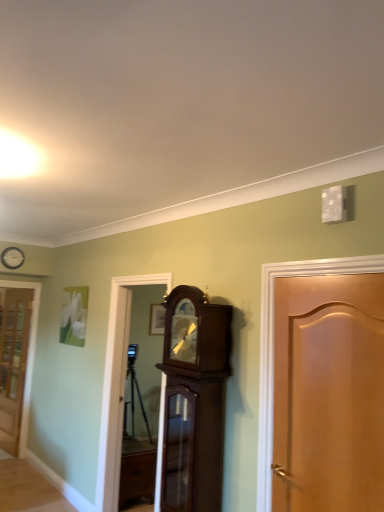
Question: Can you confirm if brown wooden cabinet at center, which ranks as the first cabinetry in back-to-front order, is taller than mahogany wood grandfather clock at center, the first cabinetry from the top?

Choices:
 (A) yes
 (B) no

Answer: (B)

Question: Is brown wooden cabinet at center, placed as the second cabinetry when sorted from front to back, closer to camera compared to mahogany wood grandfather clock at center, the 2th cabinetry in the back-to-front sequence?

Choices:
 (A) no
 (B) yes

Answer: (A)

Question: From the image's perspective, is brown wooden cabinet at center, which ranks as the first cabinetry in back-to-front order, located beneath mahogany wood grandfather clock at center, which ranks as the second cabinetry in bottom-to-top order?

Choices:
 (A) no
 (B) yes

Answer: (B)

Question: Is brown wooden cabinet at center, placed as the second cabinetry when sorted from front to back, bigger than mahogany wood grandfather clock at center, the 2th cabinetry viewed from the left?

Choices:
 (A) yes
 (B) no

Answer: (B)

Question: From the image's perspective, is brown wooden cabinet at center, which appears as the 2th cabinetry when viewed from the right, located above mahogany wood grandfather clock at center, the first cabinetry from the top?

Choices:
 (A) yes
 (B) no

Answer: (B)

Question: Is brown wooden cabinet at center, placed as the second cabinetry when sorted from front to back, at the right side of mahogany wood grandfather clock at center, the first cabinetry from the front?

Choices:
 (A) yes
 (B) no

Answer: (B)

Question: Is mahogany wood grandfather clock at center, the first cabinetry from the front, aimed at translucent glass door at left, which is the second door from right to left?

Choices:
 (A) yes
 (B) no

Answer: (B)

Question: Does mahogany wood grandfather clock at center, the 2th cabinetry in the back-to-front sequence, have a larger size compared to translucent glass door at left, which is counted as the 1th door, starting from the back?

Choices:
 (A) yes
 (B) no

Answer: (A)

Question: Can you see mahogany wood grandfather clock at center, the first cabinetry from the front, touching translucent glass door at left, which is the second door from right to left?

Choices:
 (A) yes
 (B) no

Answer: (B)

Question: Does mahogany wood grandfather clock at center, the first cabinetry from the top, have a lesser height compared to translucent glass door at left, which is the 2th door from front to back?

Choices:
 (A) yes
 (B) no

Answer: (A)

Question: Considering the relative sizes of mahogany wood grandfather clock at center, the 2th cabinetry viewed from the left, and translucent glass door at left, positioned as the 1th door in left-to-right order, in the image provided, is mahogany wood grandfather clock at center, the 2th cabinetry viewed from the left, thinner than translucent glass door at left, positioned as the 1th door in left-to-right order,?

Choices:
 (A) no
 (B) yes

Answer: (A)

Question: Considering the relative sizes of mahogany wood grandfather clock at center, the 2th cabinetry viewed from the left, and translucent glass door at left, which is the 2th door from front to back, in the image provided, is mahogany wood grandfather clock at center, the 2th cabinetry viewed from the left, wider than translucent glass door at left, which is the 2th door from front to back,?

Choices:
 (A) yes
 (B) no

Answer: (A)

Question: Is white wooden clock at upper left positioned behind mahogany wood grandfather clock at center, the first cabinetry from the top?

Choices:
 (A) yes
 (B) no

Answer: (A)